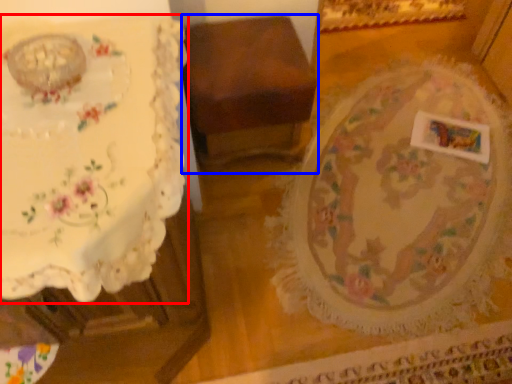
Question: Which of the following is the farthest to the observer, table (highlighted by a red box) or furniture (highlighted by a blue box)?

Choices:
 (A) table
 (B) furniture

Answer: (B)